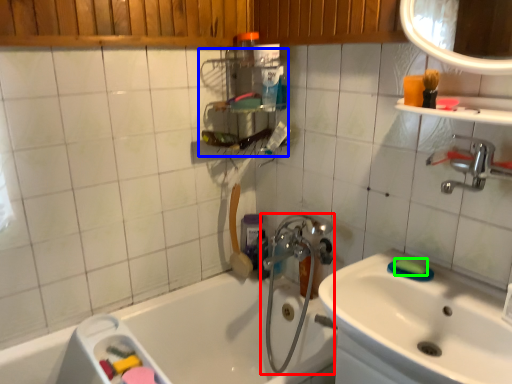
Question: Considering the real-world distances, which object is farthest from plumbing fixture (highlighted by a red box)? shelf (highlighted by a blue box) or soap (highlighted by a green box)?

Choices:
 (A) shelf
 (B) soap

Answer: (B)